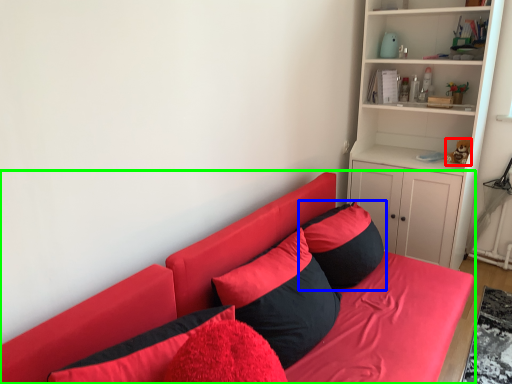
Question: Estimate the real-world distances between objects in this image. Which object is farther from toy (highlighted by a red box), pillow (highlighted by a blue box) or studio couch (highlighted by a green box)?

Choices:
 (A) pillow
 (B) studio couch

Answer: (B)